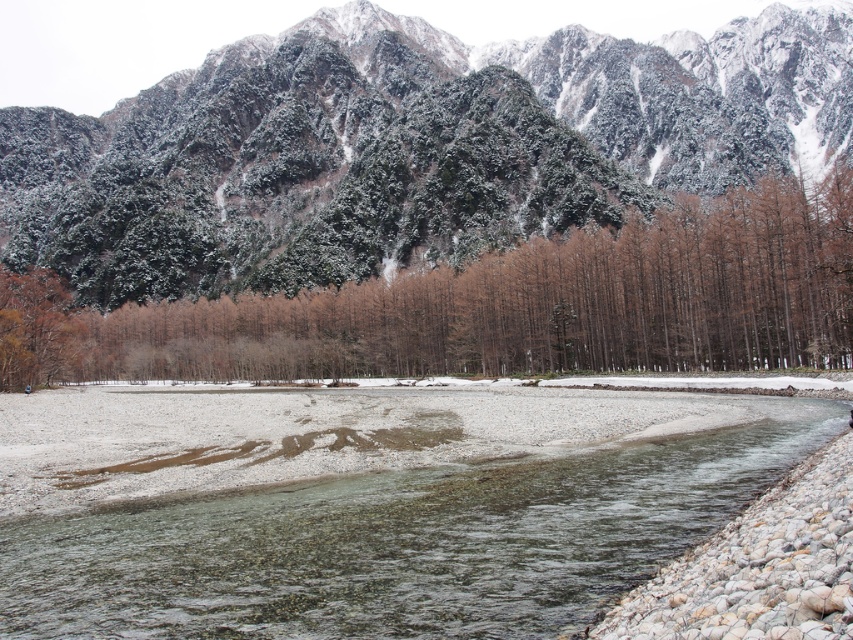
You are standing at the edge of the river and want to cross to the other side. You see a clear gravel bed at center and brown matte trees at center. Which path would be safer to walk on?

The clear gravel bed at center is closer to the viewer than brown matte trees at center, so it is safer to walk on the clear gravel bed at center since it is more accessible and stable.

You are an environmental scientist assessing the landscape. You need to determine the feasibility of installing a water monitoring station between the green textured mountain at upper center and the clear gravel bed at center. Given that the equipment requires a minimum of 500 feet of space between the mountain and the gravel bed for safe installation, can the station be placed there?

The distance between the green textured mountain at upper center and the clear gravel bed at center is 536.97 feet, which exceeds the required 500 feet. Therefore, the water monitoring station can be safely installed between them.

You are an environmental scientist studying the landscape. You observe the green textured mountain at upper center and the clear gravel bed at center. Based on their positions, which object is located to the east if the image is oriented with north at the top?

The green textured mountain at upper center is to the right of the clear gravel bed at center. Since the image is oriented with north at the top, right would correspond to east. Therefore, the green textured mountain at upper center is located to the east of the clear gravel bed at center.